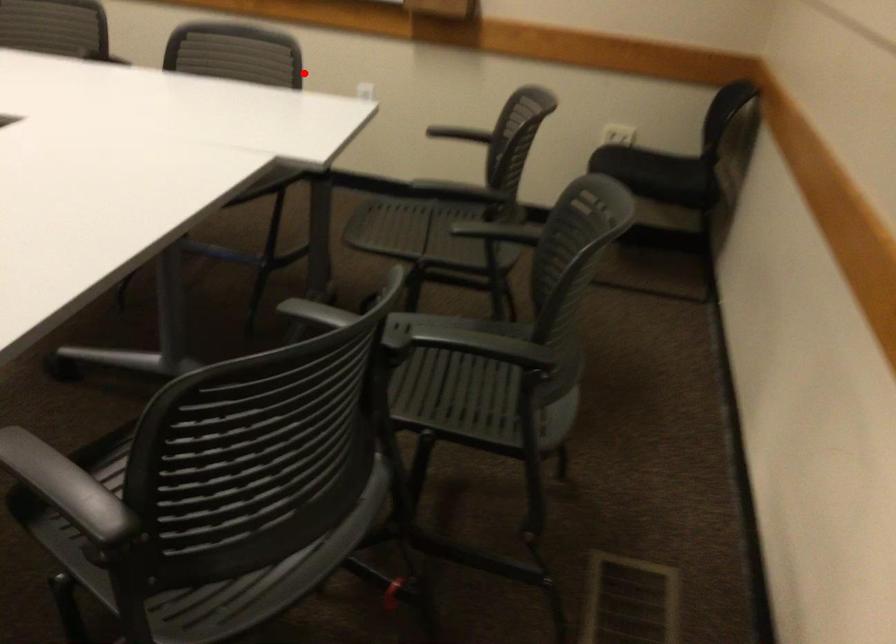
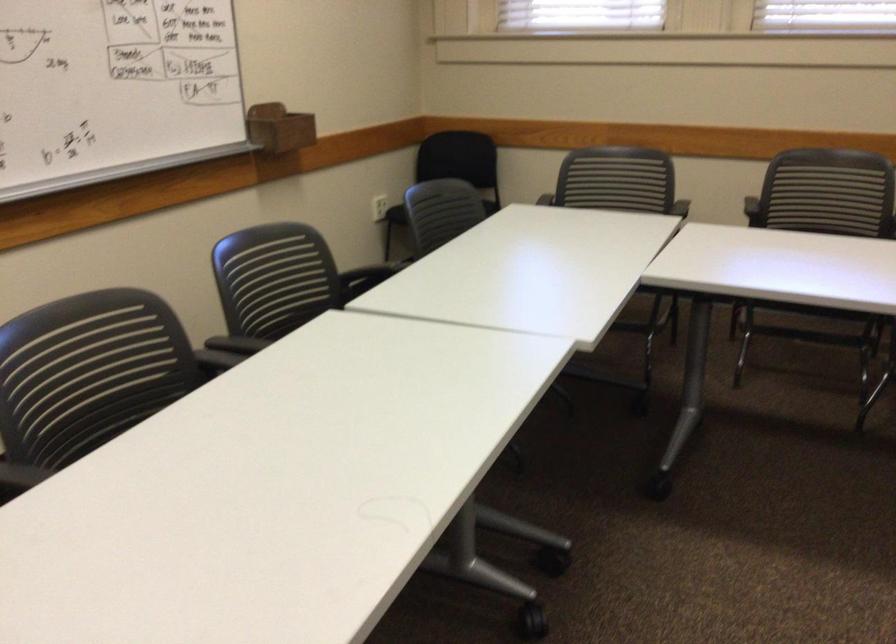
Question: I am providing you with two images of the same scene from different viewpoints. Given a red point in image1, look at the same physical point in image2. Is it:

Choices:
 (A) Closer to the viewpoint
 (B) Farther from the viewpoint

Answer: (B)